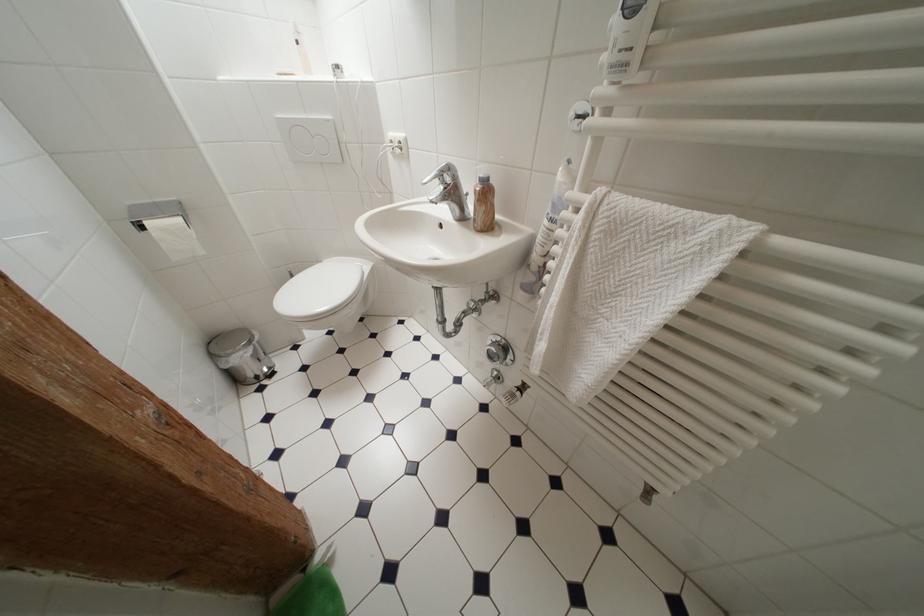
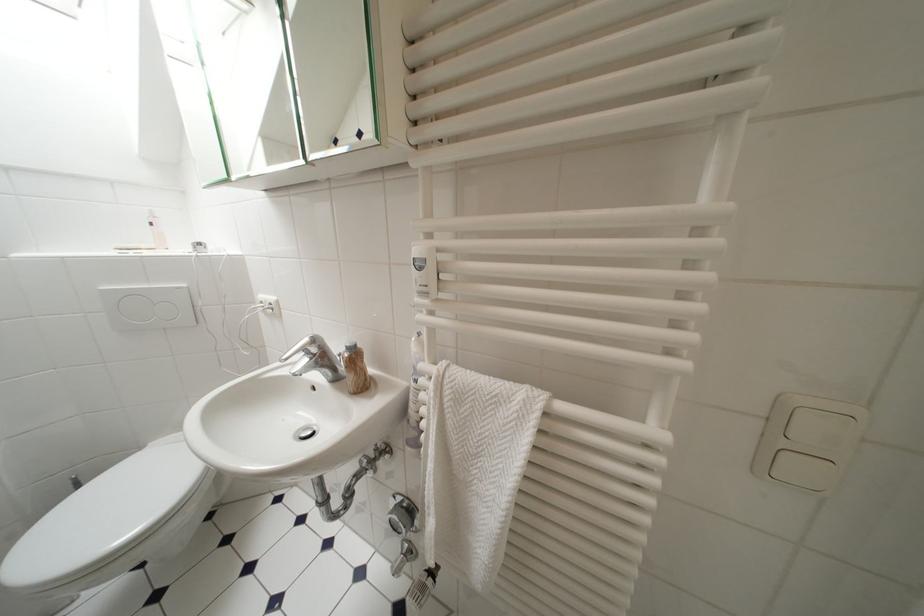
Where in the second image is the point corresponding to the point at 325,265 from the first image?

(148, 451)